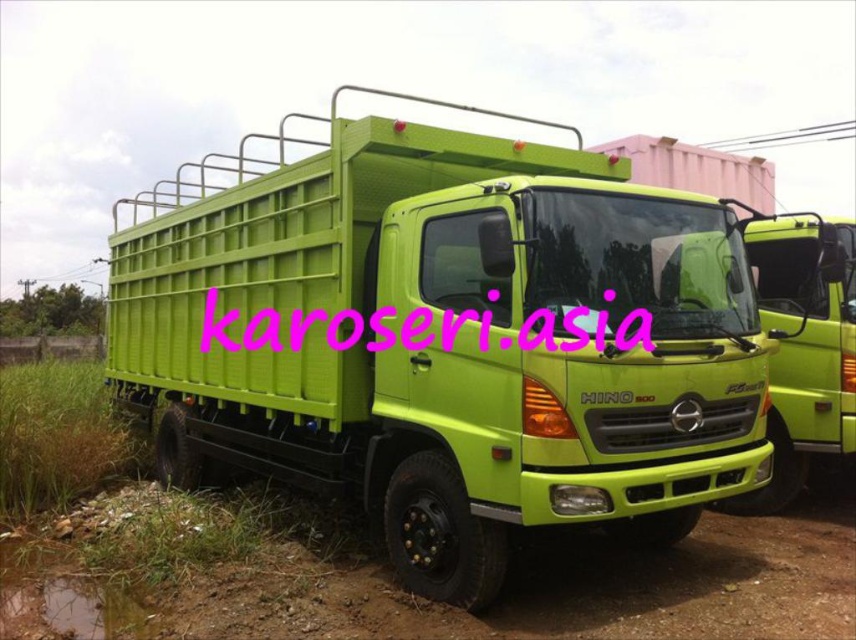
Which of these two, lime green plastic truck at center or green matte dirt track at lower left, stands shorter?

green matte dirt track at lower left is shorter.

Measure the distance between point (395, 195) and camera.

A distance of 5.35 meters exists between point (395, 195) and camera.

Does point (361, 262) come closer to viewer compared to point (54, 586)?

That is False.

Identify the location of lime green plastic truck at center. The height and width of the screenshot is (640, 856). (449, 339).